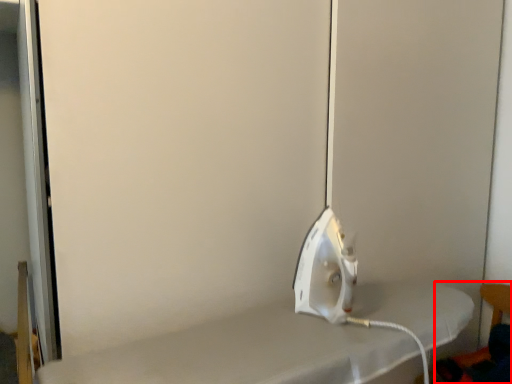
Question: From the image's perspective, what is the correct spatial positioning of chair (annotated by the red box) in reference to appliance?

Choices:
 (A) above
 (B) below

Answer: (B)